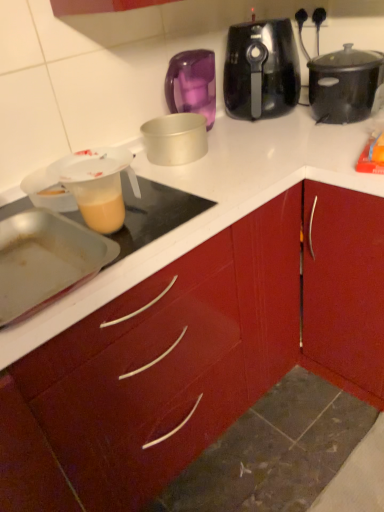
Find the location of a particular element. The image size is (384, 512). free point below black plastic slow cooker at upper center, marked as the second slow cooker in a right-to-left arrangement (from a real-world perspective) is located at coordinates (264, 120).